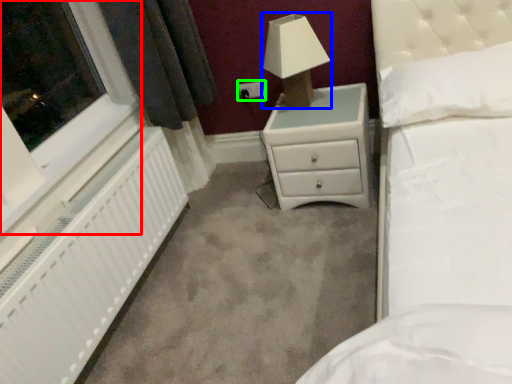
Question: Which object is positioned closest to window (highlighted by a red box)? Select from lamp (highlighted by a blue box) and electric outlet (highlighted by a green box).

Choices:
 (A) lamp
 (B) electric outlet

Answer: (A)